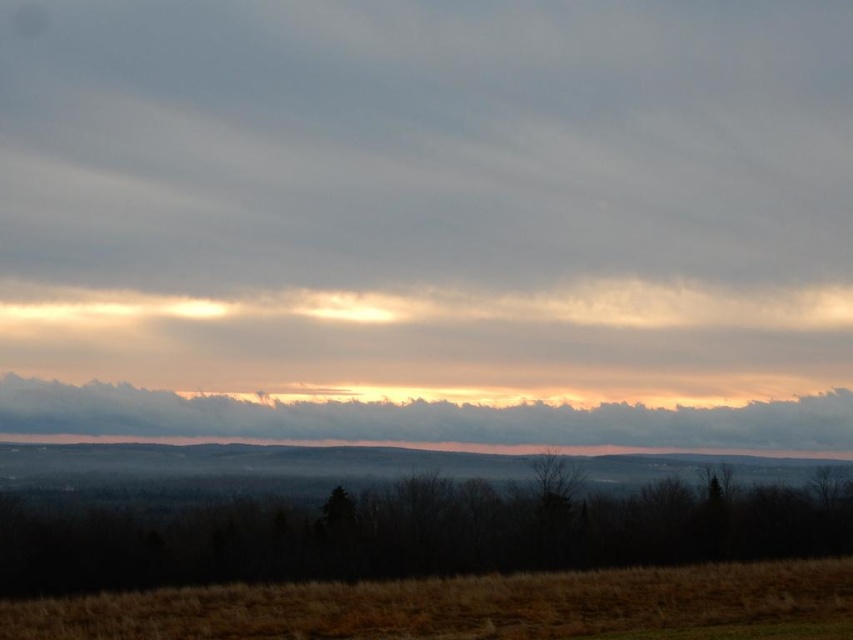
You are standing at the base of the brown grass at lower center and want to reach the cloudy at upper center. Considering the distance, can you walk straight ahead to reach it?

The distance between brown grass at lower center and cloudy at upper center is 78.09 meters, so yes, you can walk straight ahead to reach it as it is a manageable distance.

You are standing at the origin point in the image. Where is the brown grass at lower center located in terms of 2D coordinates?

The brown grass at lower center is located at coordinates point (462,605).